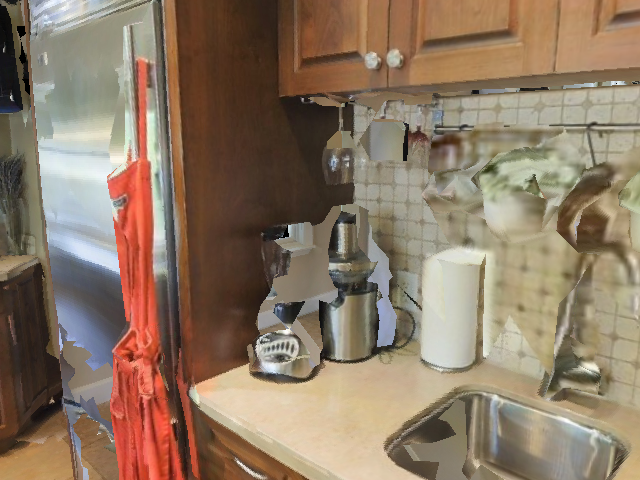
The height and width of the screenshot is (480, 640). Find the location of `blender`. blender is located at coordinates (272, 355).